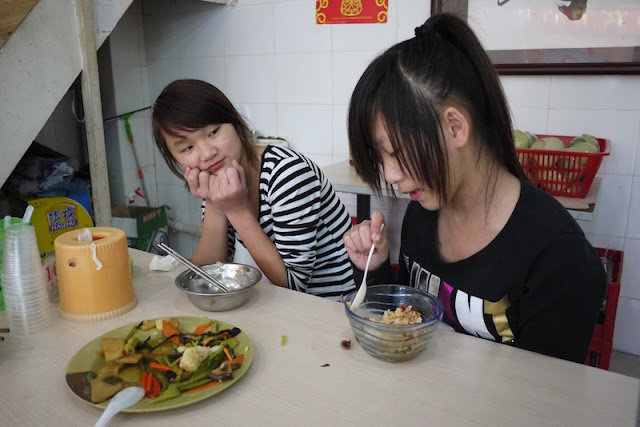
Find the location of a particular element. The image size is (640, 427). glass bowl of food is located at coordinates (404, 319).